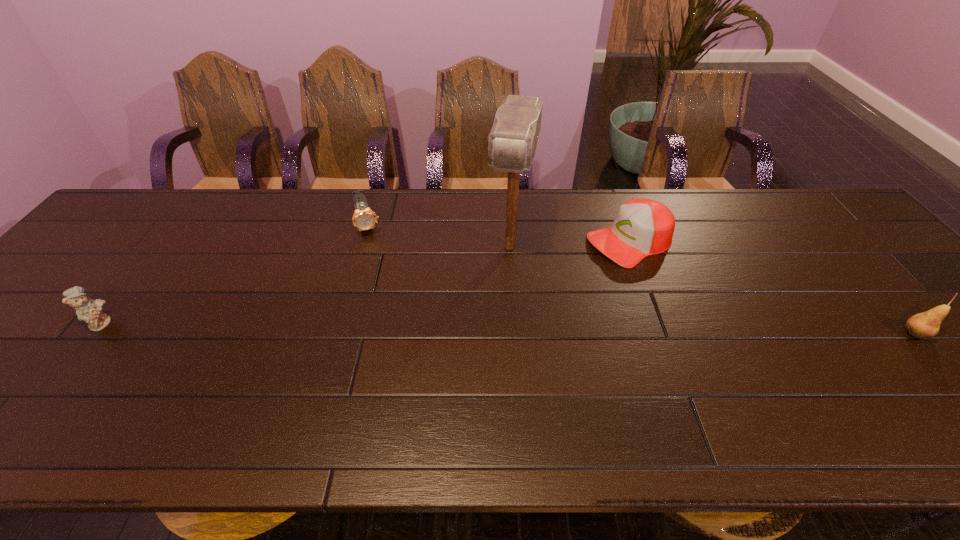
Where is `free point between the mallet and the pear`? The width and height of the screenshot is (960, 540). free point between the mallet and the pear is located at coordinates (712, 291).

Locate an element on the screen. The image size is (960, 540). free space between the rightmost object and the second object from left to right is located at coordinates (641, 280).

You are a GUI agent. You are given a task and a screenshot of the screen. Output one action in this format:
    pyautogui.click(x=<x>, y=<y>)
    Task: Click on the free area in between the baseball cap and the tallest object
    
    Given the screenshot: What is the action you would take?
    pyautogui.click(x=570, y=244)

The image size is (960, 540). What are the coordinates of `empty space that is in between the pear and the third object from left to right` in the screenshot? It's located at (712, 291).

Image resolution: width=960 pixels, height=540 pixels. I want to click on free point between the watch and the pear, so click(641, 280).

At what (x,y) coordinates should I click in order to perform the action: click on free space between the third object from right to left and the teddy bear. Please return your answer as a coordinate pair (x, y). This screenshot has width=960, height=540. Looking at the image, I should click on (305, 285).

Where is `free point between the pear and the fourth object from left to right`? The height and width of the screenshot is (540, 960). free point between the pear and the fourth object from left to right is located at coordinates (773, 288).

Identify which object is the fourth closest to the watch. Please provide its 2D coordinates. Your answer should be formatted as a tuple, i.e. [(x, y)], where the tuple contains the x and y coordinates of a point satisfying the conditions above.

[(925, 325)]

This screenshot has height=540, width=960. Identify the location of object that stands as the second closest to the fourth object from left to right. (925, 325).

Where is `blank area in the image that satisfies the following two spatial constraints: 1. on the front side of the watch; 2. on the right side of the mallet`? The height and width of the screenshot is (540, 960). blank area in the image that satisfies the following two spatial constraints: 1. on the front side of the watch; 2. on the right side of the mallet is located at coordinates (363, 247).